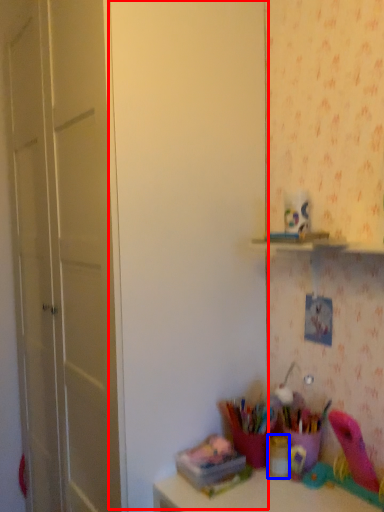
Question: Which point is further to the camera, door (highlighted by a red box) or stationery (highlighted by a blue box)?

Choices:
 (A) door
 (B) stationery

Answer: (B)